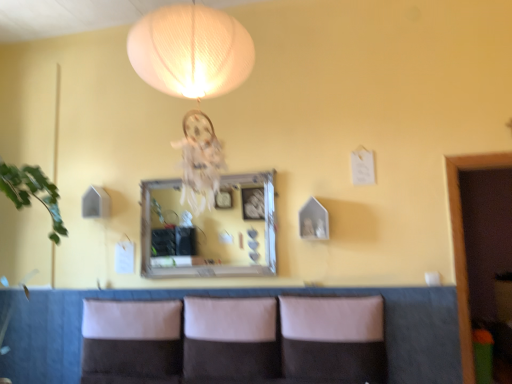
The image size is (512, 384). I want to click on empty space that is ontop of wooden-framed mirror at center (from a real-world perspective), so click(217, 181).